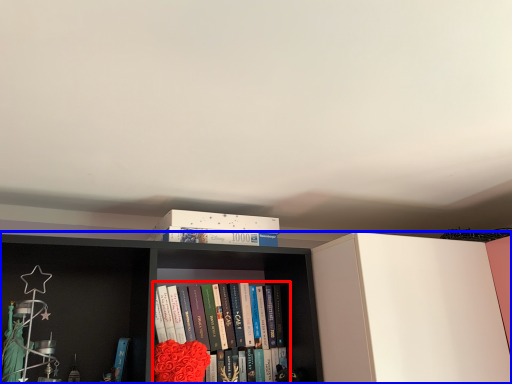
Question: Which point is closer to the camera, book (highlighted by a red box) or bookcase (highlighted by a blue box)?

Choices:
 (A) book
 (B) bookcase

Answer: (B)